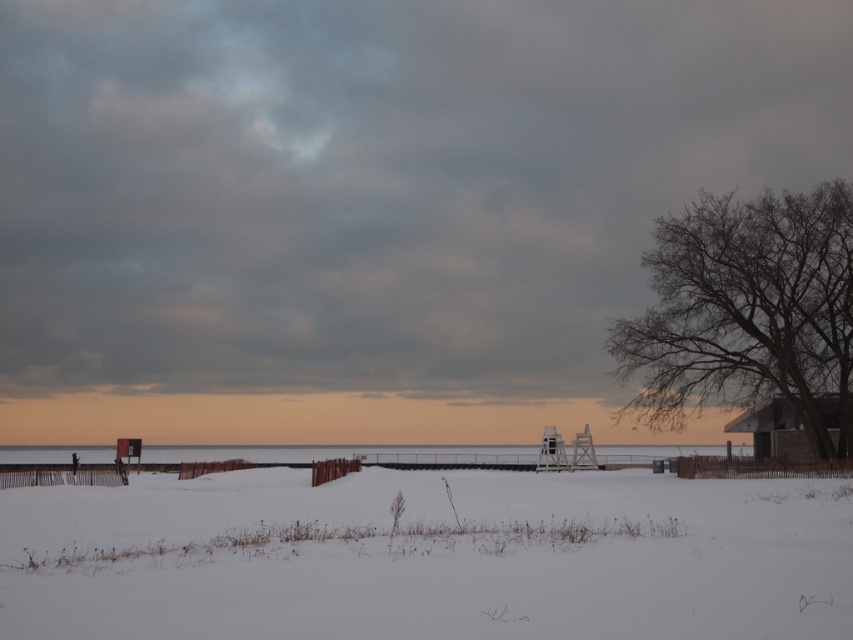
Question: Can you confirm if white fluffy snow at center is smaller than wooden cabin at right?

Choices:
 (A) no
 (B) yes

Answer: (A)

Question: Is white fluffy snow at center closer to the viewer compared to bare branches at right?

Choices:
 (A) yes
 (B) no

Answer: (A)

Question: Can you confirm if white fluffy snow at center is wider than clear water at center?

Choices:
 (A) no
 (B) yes

Answer: (A)

Question: Which of the following is the farthest from the observer?

Choices:
 (A) bare branches at right
 (B) wooden cabin at right

Answer: (A)

Question: Estimate the real-world distances between objects in this image. Which object is farther from the white fluffy snow at center?

Choices:
 (A) bare branches at right
 (B) wooden cabin at right

Answer: (B)

Question: Which point appears farthest from the camera in this image?

Choices:
 (A) (306, 451)
 (B) (381, 484)

Answer: (A)